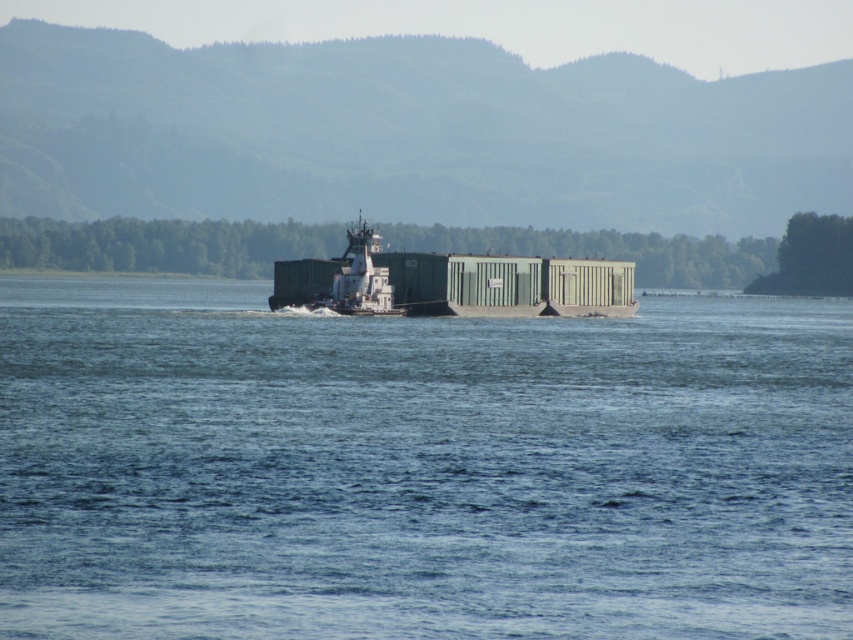
You are a sailor on a small boat trying to pass through the area between the blue water at center and the green matte container ship at center. Can your boat, which is 10 meters wide, safely navigate through the space between them?

The blue water at center has a larger width than the green matte container ship at center, so the space between them is sufficient for a 10 meter wide boat to pass safely.

You are standing on the deck of the barge and looking at the point marked at coordinates (418,467). What color is the object located at that point?

The point at coordinates (418,467) indicates blue water at center.

You are a crane operator on the green matte container ship at center. You need to lower a heavy crate into the blue water at center. Can you safely lower it without the crate hitting the ship?

The blue water at center is not as tall as the green matte container ship at center, so the crate can be safely lowered into the blue water at center without hitting the ship.